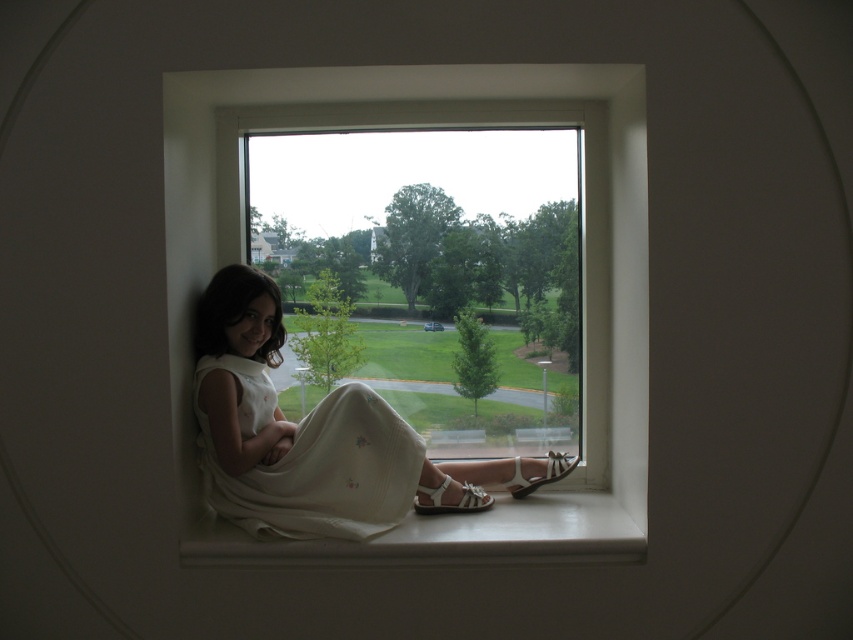
Question: From the image, what is the correct spatial relationship of white cotton dress at lower left in relation to white leather sandal at lower right?

Choices:
 (A) right
 (B) left

Answer: (B)

Question: Based on their relative distances, which object is farther from the white smooth window sill at lower center?

Choices:
 (A) white cotton dress at lower center
 (B) white plastic window at center
 (C) white cotton dress at lower left

Answer: (B)

Question: Is white cotton dress at lower left in front of white smooth window sill at lower center?

Choices:
 (A) no
 (B) yes

Answer: (A)

Question: Among these objects, which one is farthest from the camera?

Choices:
 (A) white cotton dress at lower center
 (B) white plastic window at center

Answer: (A)

Question: Which object appears farthest from the camera in this image?

Choices:
 (A) white cotton dress at lower left
 (B) white smooth window sill at lower center
 (C) white leather sandal at lower right
 (D) white cotton dress at lower center

Answer: (C)

Question: Does white plastic window at center appear under white leather sandal at lower right?

Choices:
 (A) yes
 (B) no

Answer: (B)